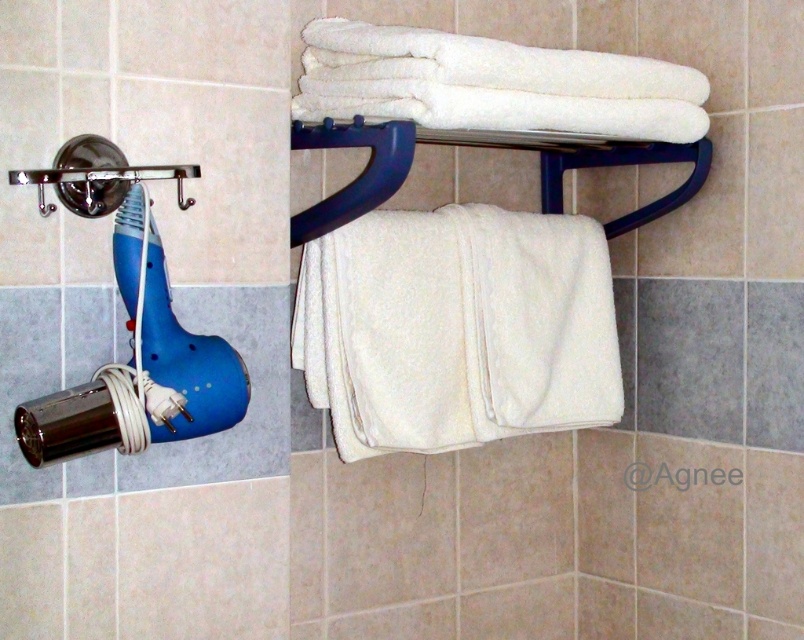
Question: Observing the image, what is the correct spatial positioning of white soft towel at upper center in reference to brushed metal shower head at left?

Choices:
 (A) above
 (B) below

Answer: (A)

Question: Does white soft towel at upper right appear on the right side of white soft towel at upper center?

Choices:
 (A) no
 (B) yes

Answer: (B)

Question: Which object is closer to the camera taking this photo?

Choices:
 (A) white soft towel at upper right
 (B) white soft towel at upper center

Answer: (A)

Question: Which point appears closest to the camera in this image?

Choices:
 (A) (605, 104)
 (B) (99, 148)

Answer: (B)

Question: From the image, what is the correct spatial relationship of white soft towel at upper center in relation to brushed metal shower head at left?

Choices:
 (A) above
 (B) below

Answer: (A)

Question: Considering the real-world distances, which object is closest to the white soft towel at upper right?

Choices:
 (A) white soft towel at upper center
 (B) brushed metal shower head at left

Answer: (A)